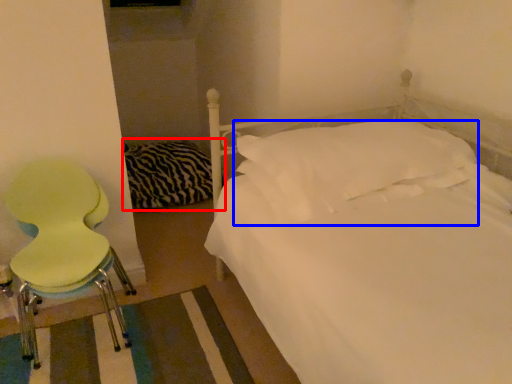
Question: Among these objects, which one is farthest to the camera, bedding (highlighted by a red box) or pillow (highlighted by a blue box)?

Choices:
 (A) bedding
 (B) pillow

Answer: (A)